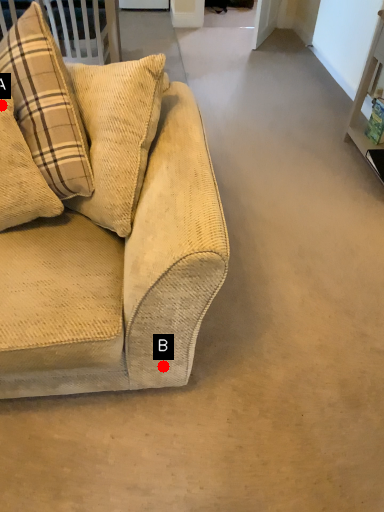
Question: Two points are circled on the image, labeled by A and B beside each circle. Which point is closer to the camera?

Choices:
 (A) A is closer
 (B) B is closer

Answer: (A)